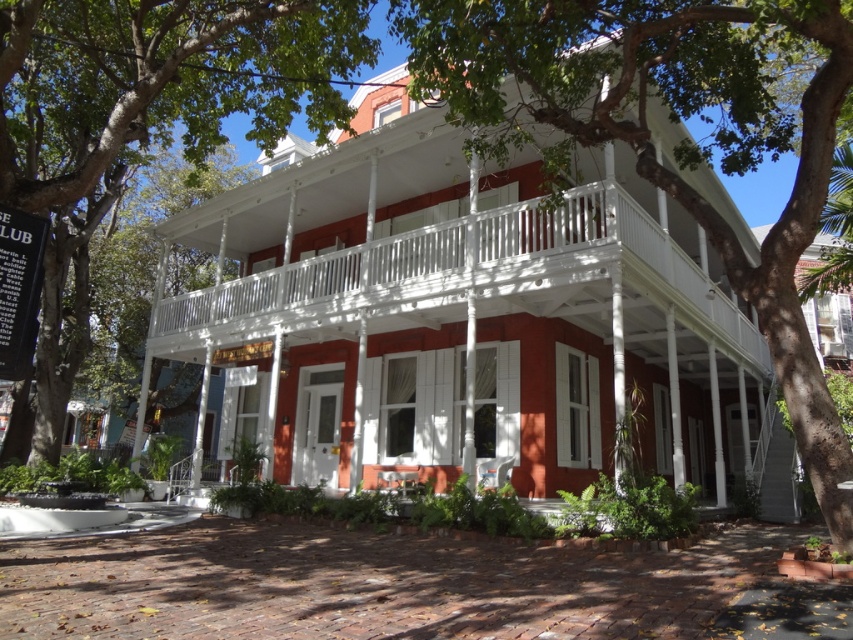
Question: In this image, where is green leafy tree at upper left located relative to white wooden balcony at center?

Choices:
 (A) below
 (B) above

Answer: (B)

Question: Among these objects, which one is nearest to the camera?

Choices:
 (A) green leafy tree at upper left
 (B) white wooden balcony at center

Answer: (A)

Question: Can you confirm if green leafy tree at upper center is positioned below white wooden balcony at center?

Choices:
 (A) yes
 (B) no

Answer: (B)

Question: Which object is positioned farthest from the green leafy tree at upper center?

Choices:
 (A) green leafy tree at upper left
 (B) white wooden balcony at center

Answer: (A)

Question: Does green leafy tree at upper center appear on the right side of white wooden balcony at center?

Choices:
 (A) yes
 (B) no

Answer: (A)

Question: Which is farther from the green leafy tree at upper center?

Choices:
 (A) white wooden balcony at center
 (B) green leafy tree at upper left

Answer: (B)